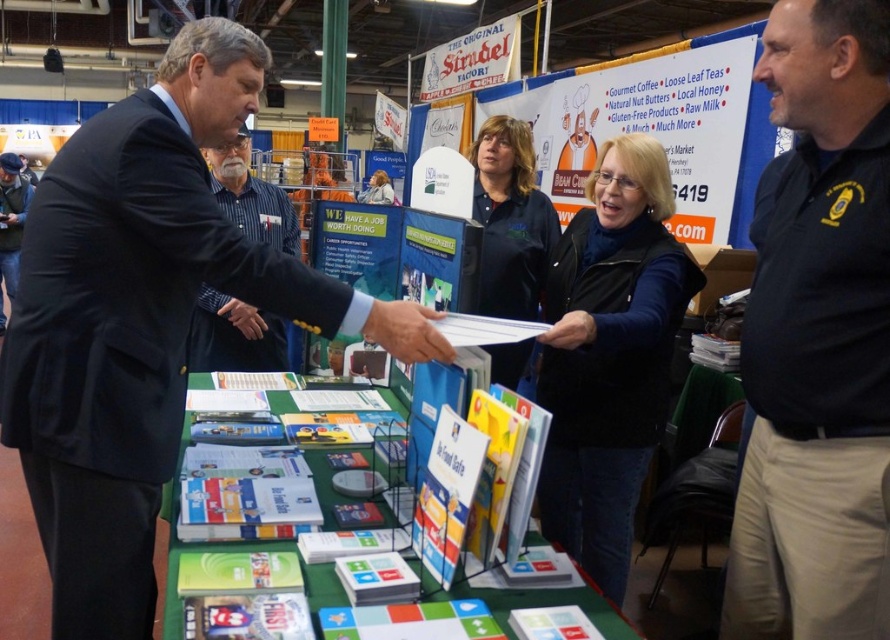
Question: In this image, where is matte black vest at center located relative to striped shirt at center?

Choices:
 (A) above
 (B) below

Answer: (B)

Question: Estimate the real-world distances between objects in this image. Which object is farther from the dark blue uniform at center?

Choices:
 (A) black leather hand at center
 (B) matte black hand at center

Answer: (B)

Question: Among these points, which one is farthest from the camera?

Choices:
 (A) (442, 348)
 (B) (241, 301)

Answer: (B)

Question: Can you confirm if matte black vest at center is thinner than matte black jacket at center?

Choices:
 (A) yes
 (B) no

Answer: (A)

Question: Which object appears closest to the camera in this image?

Choices:
 (A) dark blue uniform at right
 (B) white paper at center
 (C) dark blue suit at center

Answer: (C)

Question: Can you confirm if dark blue uniform at center is positioned to the right of matte black hand at center?

Choices:
 (A) yes
 (B) no

Answer: (A)